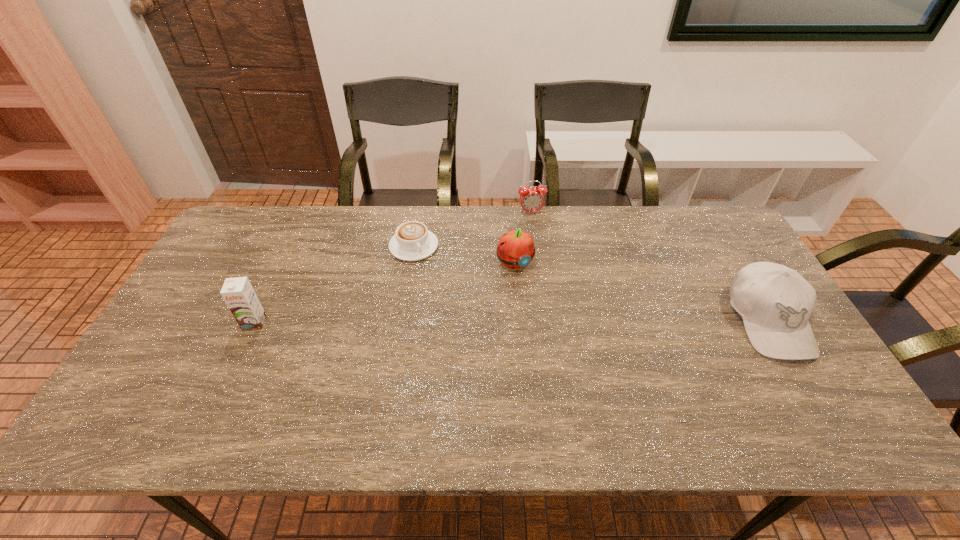
Locate an element on the screen. This screenshot has width=960, height=540. the leftmost object is located at coordinates (238, 293).

This screenshot has width=960, height=540. I want to click on baseball cap, so click(x=775, y=302).

Find the location of a particular element. This screenshot has width=960, height=540. apple is located at coordinates (515, 250).

Find the location of a particular element. The width and height of the screenshot is (960, 540). the fourth object from right to left is located at coordinates (412, 241).

The image size is (960, 540). I want to click on the shortest object, so click(412, 241).

The width and height of the screenshot is (960, 540). Find the location of `alarm clock`. alarm clock is located at coordinates (531, 199).

Locate an element on the screen. blank space located 0.260m on the right of the chocolate milk is located at coordinates (360, 322).

The width and height of the screenshot is (960, 540). I want to click on vacant area situated on the front-facing side of the rightmost object, so click(812, 394).

Find the location of a particular element. The image size is (960, 540). vacant space located 0.080m on the surface of the apple is located at coordinates (538, 293).

The height and width of the screenshot is (540, 960). In order to click on vacant space situated 0.060m on the surface of the apple in this screenshot , I will do `click(534, 288)`.